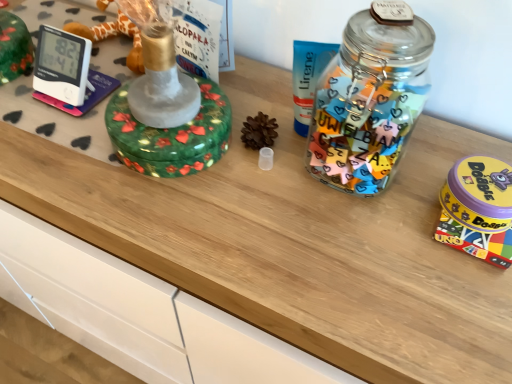
What do you see at coordinates (259, 131) in the screenshot?
I see `transparent plastic pinecone at center, marked as the 1th toy in a left-to-right arrangement` at bounding box center [259, 131].

Find the location of `transparent plastic pinecone at center, marked as the 1th toy in a left-to-right arrangement`. transparent plastic pinecone at center, marked as the 1th toy in a left-to-right arrangement is located at coordinates (259, 131).

This screenshot has height=384, width=512. Describe the element at coordinates (478, 209) in the screenshot. I see `yellow plastic game at right, the 2th toy when ordered from left to right` at that location.

Measure the distance between yellow plastic game at right, the 1th toy when ordered from right to left, and camera.

The distance of yellow plastic game at right, the 1th toy when ordered from right to left, from camera is 19.16 inches.

Consider the image. In order to face yellow plastic game at right, the 1th toy when ordered from right to left, should I rotate leftwards or rightwards?

Rotate right and turn 27.349 degrees.

What is the approximate width of yellow plastic game at right, the 1th toy when ordered from right to left?

The width of yellow plastic game at right, the 1th toy when ordered from right to left, is 6.63 inches.

You are a GUI agent. You are given a task and a screenshot of the screen. Output one action in this format:
    pyautogui.click(x=<x>, y=<y>)
    Task: Click on the yellow plastic game at right, the 1th toy when ordered from right to left
    
    Given the screenshot: What is the action you would take?
    pyautogui.click(x=478, y=209)

Where is `transparent plastic pinecone at center, marked as the 1th toy in a left-to-right arrangement`? The image size is (512, 384). transparent plastic pinecone at center, marked as the 1th toy in a left-to-right arrangement is located at coordinates (259, 131).

Considering the relative positions of transparent plastic pinecone at center, arranged as the second toy when viewed from the right, and yellow plastic game at right, the 1th toy when ordered from right to left, in the image provided, is transparent plastic pinecone at center, arranged as the second toy when viewed from the right, to the right of yellow plastic game at right, the 1th toy when ordered from right to left, from the viewer's perspective?

Incorrect, transparent plastic pinecone at center, arranged as the second toy when viewed from the right, is not on the right side of yellow plastic game at right, the 1th toy when ordered from right to left.

Based on the photo, considering their positions, is transparent plastic pinecone at center, arranged as the second toy when viewed from the right, located in front of or behind yellow plastic game at right, the 2th toy when ordered from left to right?

Visually, transparent plastic pinecone at center, arranged as the second toy when viewed from the right, is located behind yellow plastic game at right, the 2th toy when ordered from left to right.

Which point is more forward, (253, 133) or (485, 242)?

The point (485, 242) is in front.

In the scene shown: From the image's perspective, between transparent plastic pinecone at center, arranged as the second toy when viewed from the right, and yellow plastic game at right, the 2th toy when ordered from left to right, who is located below?

From the image's view, yellow plastic game at right, the 2th toy when ordered from left to right, is below.

Consider the image. From a real-world perspective, is transparent plastic pinecone at center, marked as the 1th toy in a left-to-right arrangement, above or below yellow plastic game at right, the 1th toy when ordered from right to left?

Clearly, from a real-world perspective, transparent plastic pinecone at center, marked as the 1th toy in a left-to-right arrangement, is below yellow plastic game at right, the 1th toy when ordered from right to left.

Is transparent plastic pinecone at center, arranged as the second toy when viewed from the right, wider than yellow plastic game at right, the 2th toy when ordered from left to right?

No.

Considering the sizes of objects transparent plastic pinecone at center, arranged as the second toy when viewed from the right, and yellow plastic game at right, the 2th toy when ordered from left to right, in the image provided, who is taller, transparent plastic pinecone at center, arranged as the second toy when viewed from the right, or yellow plastic game at right, the 2th toy when ordered from left to right,?

With more height is transparent plastic pinecone at center, arranged as the second toy when viewed from the right.

Consider the image. Who is bigger, transparent plastic pinecone at center, marked as the 1th toy in a left-to-right arrangement, or yellow plastic game at right, the 2th toy when ordered from left to right?

Bigger between the two is yellow plastic game at right, the 2th toy when ordered from left to right.

Would you say yellow plastic game at right, the 2th toy when ordered from left to right, is part of transparent plastic pinecone at center, marked as the 1th toy in a left-to-right arrangement,'s contents?

No, transparent plastic pinecone at center, marked as the 1th toy in a left-to-right arrangement, does not contain yellow plastic game at right, the 2th toy when ordered from left to right.

Is transparent plastic pinecone at center, marked as the 1th toy in a left-to-right arrangement, not close to yellow plastic game at right, the 2th toy when ordered from left to right?

No, transparent plastic pinecone at center, marked as the 1th toy in a left-to-right arrangement, is in close proximity to yellow plastic game at right, the 2th toy when ordered from left to right.

Could you tell me if transparent plastic pinecone at center, marked as the 1th toy in a left-to-right arrangement, is turned towards yellow plastic game at right, the 1th toy when ordered from right to left?

No, transparent plastic pinecone at center, marked as the 1th toy in a left-to-right arrangement, does not turn towards yellow plastic game at right, the 1th toy when ordered from right to left.

What's the angular difference between transparent plastic pinecone at center, arranged as the second toy when viewed from the right, and yellow plastic game at right, the 2th toy when ordered from left to right,'s facing directions?

The facing directions of transparent plastic pinecone at center, arranged as the second toy when viewed from the right, and yellow plastic game at right, the 2th toy when ordered from left to right, are 39.3 degrees apart.

Identify the location of toy located underneath the yellow plastic game at right, the 1th toy when ordered from right to left (from a real-world perspective). The image size is (512, 384). (259, 131).

Does yellow plastic game at right, the 2th toy when ordered from left to right, appear on the right side of transparent plastic pinecone at center, marked as the 1th toy in a left-to-right arrangement?

Correct, you'll find yellow plastic game at right, the 2th toy when ordered from left to right, to the right of transparent plastic pinecone at center, marked as the 1th toy in a left-to-right arrangement.

Is yellow plastic game at right, the 2th toy when ordered from left to right, closer to the viewer compared to transparent plastic pinecone at center, marked as the 1th toy in a left-to-right arrangement?

Yes.

Is point (462, 200) in front of point (262, 133)?

Yes, it is.

From the picture: From the image's perspective, which one is positioned higher, yellow plastic game at right, the 2th toy when ordered from left to right, or transparent plastic pinecone at center, arranged as the second toy when viewed from the right?

transparent plastic pinecone at center, arranged as the second toy when viewed from the right, appears higher in the image.

From a real-world perspective, which is physically below, yellow plastic game at right, the 2th toy when ordered from left to right, or transparent plastic pinecone at center, arranged as the second toy when viewed from the right?

In real-world perspective, transparent plastic pinecone at center, arranged as the second toy when viewed from the right, is lower.

Between yellow plastic game at right, the 1th toy when ordered from right to left, and transparent plastic pinecone at center, arranged as the second toy when viewed from the right, which one has larger width?

yellow plastic game at right, the 1th toy when ordered from right to left, is wider.

Does yellow plastic game at right, the 1th toy when ordered from right to left, have a lesser height compared to transparent plastic pinecone at center, marked as the 1th toy in a left-to-right arrangement?

Yes.

Which of these two, yellow plastic game at right, the 1th toy when ordered from right to left, or transparent plastic pinecone at center, arranged as the second toy when viewed from the right, is bigger?

yellow plastic game at right, the 1th toy when ordered from right to left, is bigger.

Is yellow plastic game at right, the 1th toy when ordered from right to left, positioned beyond the bounds of transparent plastic pinecone at center, marked as the 1th toy in a left-to-right arrangement?

Yes.

Is yellow plastic game at right, the 2th toy when ordered from left to right, with transparent plastic pinecone at center, marked as the 1th toy in a left-to-right arrangement?

yellow plastic game at right, the 2th toy when ordered from left to right, and transparent plastic pinecone at center, marked as the 1th toy in a left-to-right arrangement, are clearly separated.

Does yellow plastic game at right, the 1th toy when ordered from right to left, turn towards transparent plastic pinecone at center, marked as the 1th toy in a left-to-right arrangement?

No, yellow plastic game at right, the 1th toy when ordered from right to left, is not aimed at transparent plastic pinecone at center, marked as the 1th toy in a left-to-right arrangement.

At what (x,y) coordinates should I click in order to perform the action: click on toy positioned vertically above the transparent plastic pinecone at center, marked as the 1th toy in a left-to-right arrangement (from a real-world perspective). Please return your answer as a coordinate pair (x, y). The height and width of the screenshot is (384, 512). Looking at the image, I should click on (478, 209).

Locate an element on the screen. toy on the right of transparent plastic pinecone at center, arranged as the second toy when viewed from the right is located at coordinates (478, 209).

At what (x,y) coordinates should I click in order to perform the action: click on toy on the left side of yellow plastic game at right, the 1th toy when ordered from right to left. Please return your answer as a coordinate pair (x, y). Looking at the image, I should click on click(259, 131).